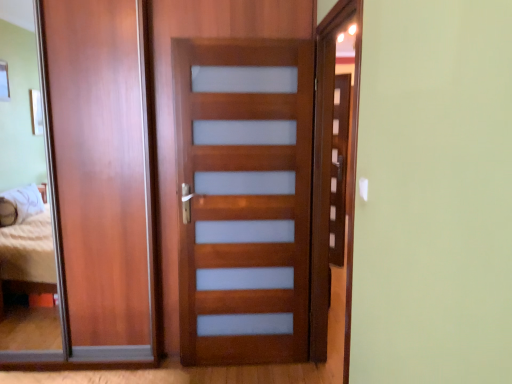
Question: Looking at the image, does satin wood door at center, which is the first screen door from left to right, seem bigger or smaller compared to matte wood barn door at left?

Choices:
 (A) small
 (B) big

Answer: (A)

Question: Choose the correct answer: Is satin wood door at center, acting as the second screen door starting from the right, inside matte wood barn door at left or outside it?

Choices:
 (A) inside
 (B) outside

Answer: (B)

Question: Based on their relative distances, which object is farther from the matte wood screen door at right, which is the 2th screen door in left-to-right order?

Choices:
 (A) matte wood barn door at left
 (B) satin wood door at center, which is the first screen door from left to right

Answer: (A)

Question: Estimate the real-world distances between objects in this image. Which object is closer to the matte wood screen door at right, acting as the 1th screen door starting from the right?

Choices:
 (A) satin wood door at center, acting as the second screen door starting from the right
 (B) matte wood barn door at left

Answer: (A)